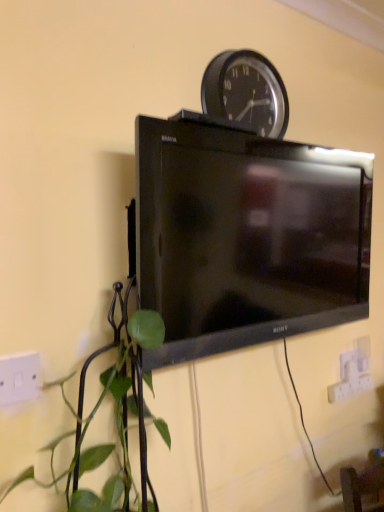
Question: From a real-world perspective, is white plastic electric outlet at lower left, marked as the second electric outlet in a bottom-to-top arrangement, on top of black plastic wall clock at upper center?

Choices:
 (A) no
 (B) yes

Answer: (A)

Question: Considering the relative sizes of white plastic electric outlet at lower left, the 1th electric outlet positioned from the left, and black plastic wall clock at upper center in the image provided, is white plastic electric outlet at lower left, the 1th electric outlet positioned from the left, bigger than black plastic wall clock at upper center?

Choices:
 (A) no
 (B) yes

Answer: (A)

Question: Is white plastic electric outlet at lower left, the 1th electric outlet positioned from the left, smaller than black plastic wall clock at upper center?

Choices:
 (A) yes
 (B) no

Answer: (A)

Question: From a real-world perspective, is white plastic electric outlet at lower left, marked as the 2th electric outlet in a right-to-left arrangement, physically below black plastic wall clock at upper center?

Choices:
 (A) no
 (B) yes

Answer: (B)

Question: Considering the relative sizes of white plastic electric outlet at lower left, the second electric outlet positioned from the back, and black plastic wall clock at upper center in the image provided, is white plastic electric outlet at lower left, the second electric outlet positioned from the back, wider than black plastic wall clock at upper center?

Choices:
 (A) yes
 (B) no

Answer: (B)

Question: Can you see white plastic electric outlet at lower left, the 1th electric outlet positioned from the left, touching black plastic wall clock at upper center?

Choices:
 (A) yes
 (B) no

Answer: (B)

Question: Considering the relative sizes of black glossy tv at center and black plastic wall clock at upper center in the image provided, is black glossy tv at center thinner than black plastic wall clock at upper center?

Choices:
 (A) no
 (B) yes

Answer: (A)

Question: Is black glossy tv at center facing away from black plastic wall clock at upper center?

Choices:
 (A) yes
 (B) no

Answer: (B)

Question: Considering the relative sizes of black glossy tv at center and black plastic wall clock at upper center in the image provided, is black glossy tv at center taller than black plastic wall clock at upper center?

Choices:
 (A) no
 (B) yes

Answer: (B)

Question: Is black glossy tv at center positioned behind black plastic wall clock at upper center?

Choices:
 (A) no
 (B) yes

Answer: (A)

Question: Is black glossy tv at center bigger than black plastic wall clock at upper center?

Choices:
 (A) no
 (B) yes

Answer: (B)

Question: Does black glossy tv at center lie in front of black plastic wall clock at upper center?

Choices:
 (A) yes
 (B) no

Answer: (A)

Question: Can you confirm if black glossy tv at center is smaller than white plastic electric outlet at lower right, which ranks as the first electric outlet in bottom-to-top order?

Choices:
 (A) yes
 (B) no

Answer: (B)